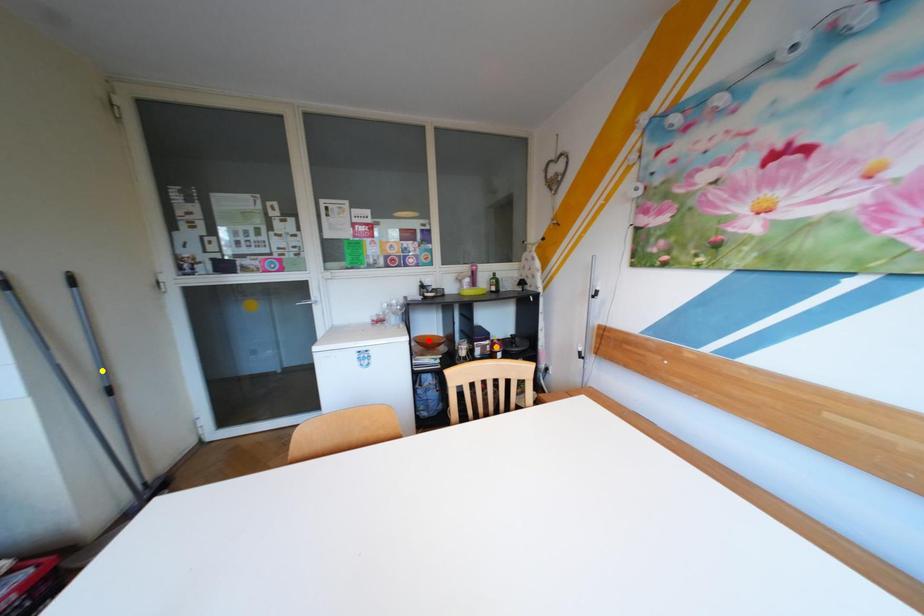
Order these from nearest to farthest:
red point | orange point | yellow point

yellow point, orange point, red point